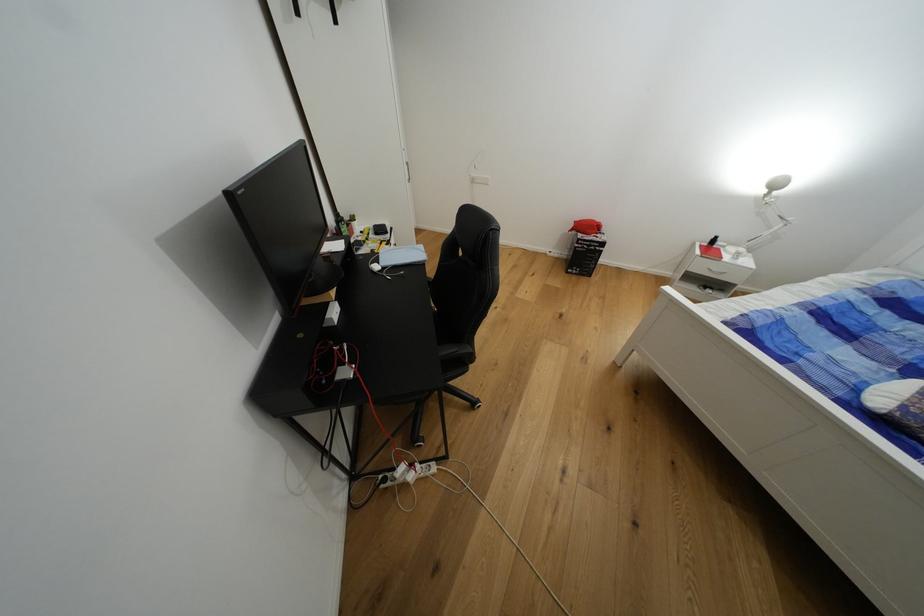
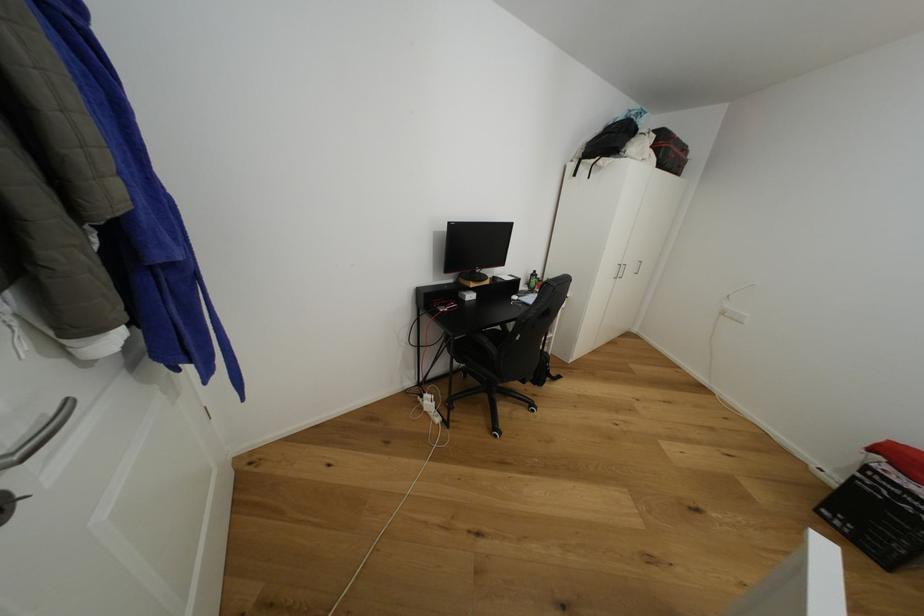
The point at (x=460, y=351) is marked in the first image. Where is the corresponding point in the second image?

(491, 342)